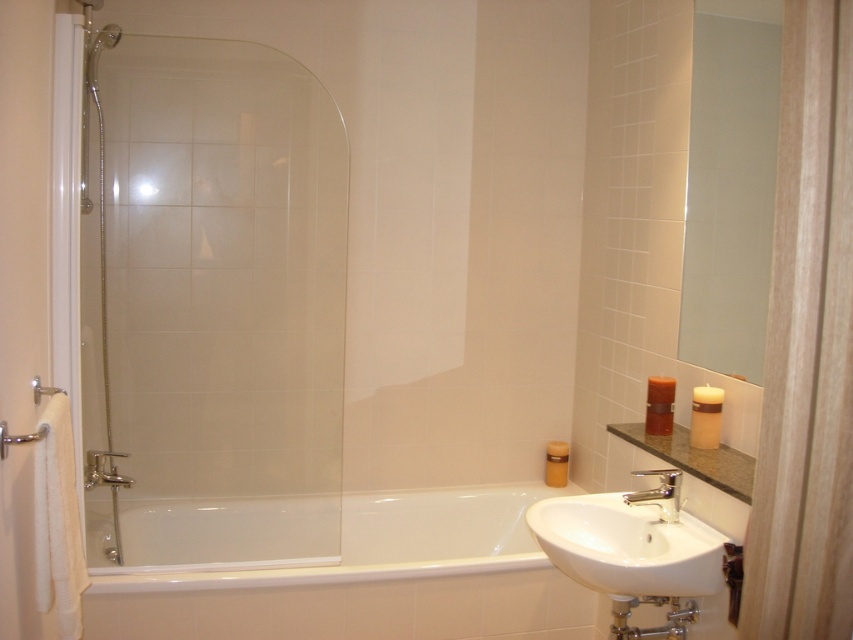
Question: From the image, what is the correct spatial relationship of clear glass shower door at left in relation to silver metallic faucet at lower center?

Choices:
 (A) below
 (B) above

Answer: (B)

Question: Among these objects, which one is farthest from the camera?

Choices:
 (A) white glossy bathtub at center
 (B) silver metallic faucet at lower center
 (C) clear glass shower door at left
 (D) white ceramic sink at lower right

Answer: (A)

Question: Is wooden screen door at right smaller than white ceramic sink at lower right?

Choices:
 (A) no
 (B) yes

Answer: (B)

Question: Considering the relative positions of wooden screen door at right and white ceramic sink at lower right in the image provided, where is wooden screen door at right located with respect to white ceramic sink at lower right?

Choices:
 (A) above
 (B) below

Answer: (A)

Question: Which of the following is the farthest from the observer?

Choices:
 (A) (608, 522)
 (B) (404, 513)

Answer: (B)

Question: Which object appears closest to the camera in this image?

Choices:
 (A) silver metallic faucet at lower center
 (B) white ceramic sink at lower right

Answer: (B)